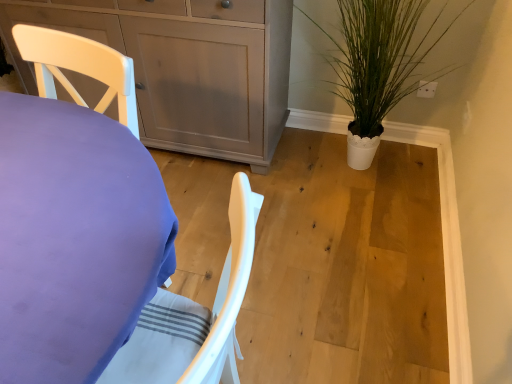
Question: Considering the relative sizes of purple fabric-covered desk at left and matte gray cabinet at upper left in the image provided, is purple fabric-covered desk at left bigger than matte gray cabinet at upper left?

Choices:
 (A) no
 (B) yes

Answer: (A)

Question: Considering the relative sizes of purple fabric-covered desk at left and matte gray cabinet at upper left in the image provided, is purple fabric-covered desk at left thinner than matte gray cabinet at upper left?

Choices:
 (A) yes
 (B) no

Answer: (B)

Question: Is matte gray cabinet at upper left surrounded by purple fabric-covered desk at left?

Choices:
 (A) yes
 (B) no

Answer: (B)

Question: Does purple fabric-covered desk at left have a smaller size compared to matte gray cabinet at upper left?

Choices:
 (A) no
 (B) yes

Answer: (B)

Question: Does purple fabric-covered desk at left come behind matte gray cabinet at upper left?

Choices:
 (A) no
 (B) yes

Answer: (A)

Question: Relative to matte gray cabinet at upper left, is purple fabric-covered desk at left in front or behind?

Choices:
 (A) front
 (B) behind

Answer: (A)

Question: Is purple fabric-covered desk at left to the left or to the right of matte gray cabinet at upper left in the image?

Choices:
 (A) left
 (B) right

Answer: (A)

Question: From a real-world perspective, is purple fabric-covered desk at left physically located above or below matte gray cabinet at upper left?

Choices:
 (A) above
 (B) below

Answer: (A)

Question: Which is correct: purple fabric-covered desk at left is inside matte gray cabinet at upper left, or outside of it?

Choices:
 (A) inside
 (B) outside

Answer: (B)

Question: Does point (377, 97) appear closer or farther from the camera than point (136, 52)?

Choices:
 (A) closer
 (B) farther

Answer: (B)

Question: From a real-world perspective, is white matte pot at right physically located above or below matte gray cabinet at upper left?

Choices:
 (A) below
 (B) above

Answer: (B)

Question: From their relative heights in the image, would you say white matte pot at right is taller or shorter than matte gray cabinet at upper left?

Choices:
 (A) tall
 (B) short

Answer: (B)

Question: Considering the relative positions of white matte pot at right and matte gray cabinet at upper left in the image provided, is white matte pot at right to the left or to the right of matte gray cabinet at upper left?

Choices:
 (A) right
 (B) left

Answer: (A)

Question: Looking at the image, does matte gray cabinet at upper left seem bigger or smaller compared to purple fabric-covered desk at left?

Choices:
 (A) big
 (B) small

Answer: (A)

Question: From a real-world perspective, relative to purple fabric-covered desk at left, is matte gray cabinet at upper left vertically above or below?

Choices:
 (A) below
 (B) above

Answer: (A)